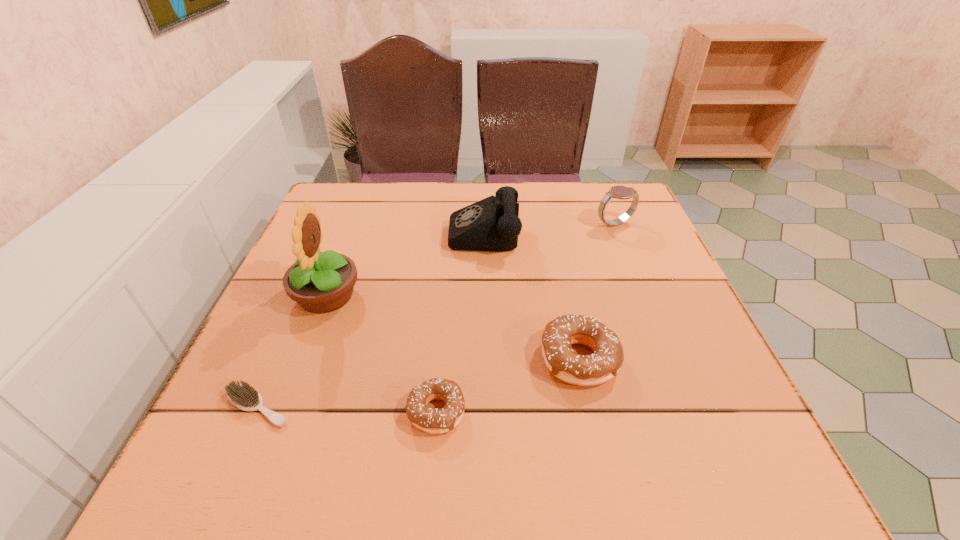
Locate an element on the screen. The width and height of the screenshot is (960, 540). vacant space at the far left corner of the desktop is located at coordinates (346, 212).

Find the location of a particular element. free spot at the near left corner of the desktop is located at coordinates (275, 409).

In the image, there is a desktop. Where is `vacant space at the far right corner`? vacant space at the far right corner is located at coordinates (582, 190).

The height and width of the screenshot is (540, 960). What are the coordinates of `free point at the near right corner` in the screenshot? It's located at (658, 420).

This screenshot has width=960, height=540. I want to click on free space between the shortest object and the telephone, so click(x=371, y=318).

Locate an element on the screen. empty location between the third tallest object and the shorter doughnut is located at coordinates (525, 318).

Where is `vacant region between the left doughnut and the fifth shortest object`? The image size is (960, 540). vacant region between the left doughnut and the fifth shortest object is located at coordinates (460, 320).

At what (x,y) coordinates should I click in order to perform the action: click on vacant region between the taller doughnut and the sunflower. Please return your answer as a coordinate pair (x, y). The image size is (960, 540). Looking at the image, I should click on (453, 327).

The height and width of the screenshot is (540, 960). Find the location of `empty space that is in between the left doughnut and the scrubbing brush`. empty space that is in between the left doughnut and the scrubbing brush is located at coordinates (348, 409).

At what (x,y) coordinates should I click in order to perform the action: click on free space between the shortest object and the fifth shortest object. Please return your answer as a coordinate pair (x, y). This screenshot has height=540, width=960. Looking at the image, I should click on (371, 318).